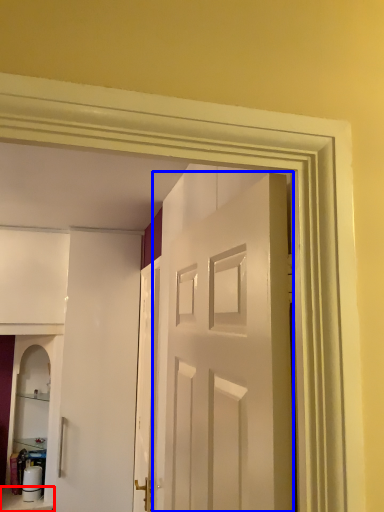
Question: Which object is further to the camera taking this photo, furniture (highlighted by a red box) or door (highlighted by a blue box)?

Choices:
 (A) furniture
 (B) door

Answer: (A)